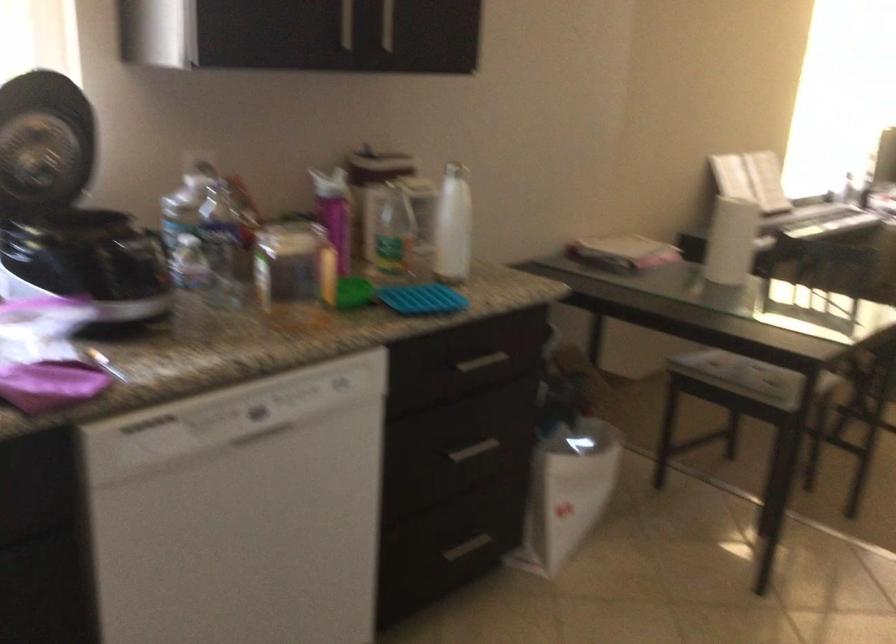
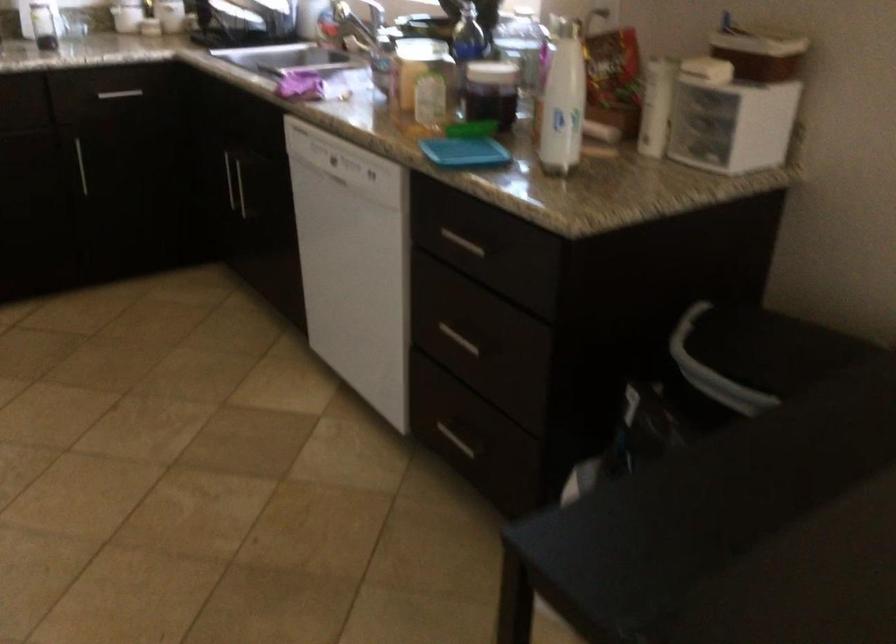
Find the pixel in the second image that matches (x=421, y=333) in the first image.

(462, 243)